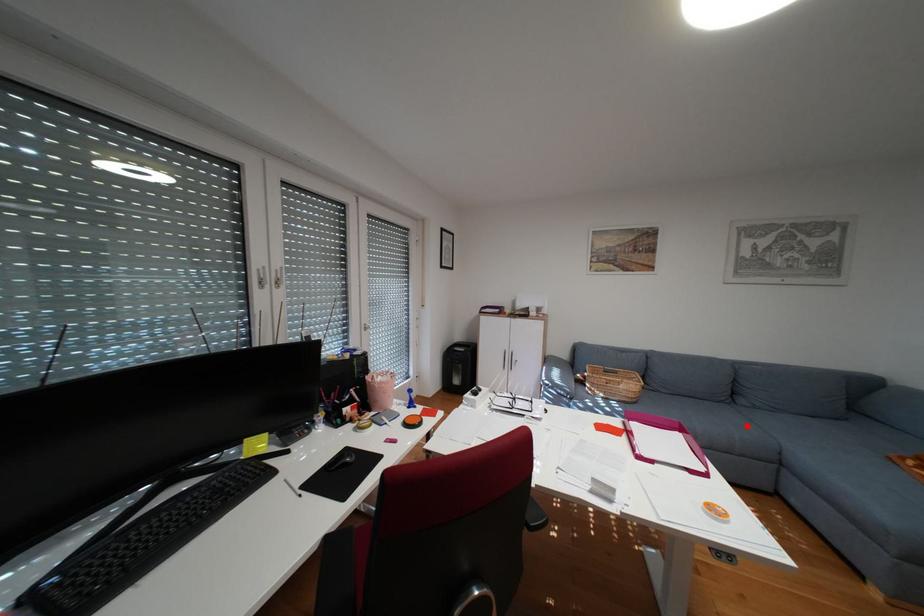
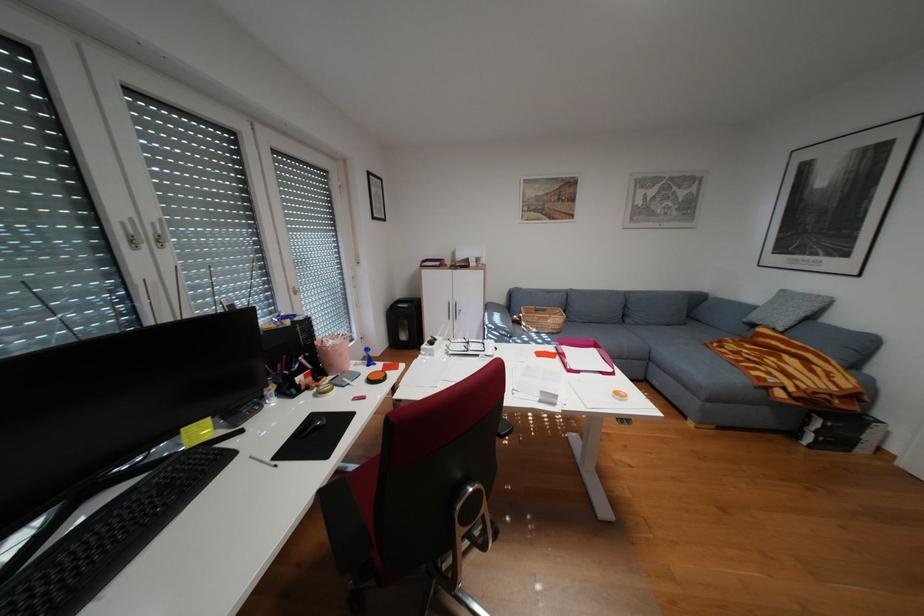
Question: A red point is marked in image1. In image2, is the corresponding 3D point closer to the camera or farther? Reply with the corresponding letter.

Choices:
 (A) The corresponding 3D point is closer.
 (B) The corresponding 3D point is farther.

Answer: (B)